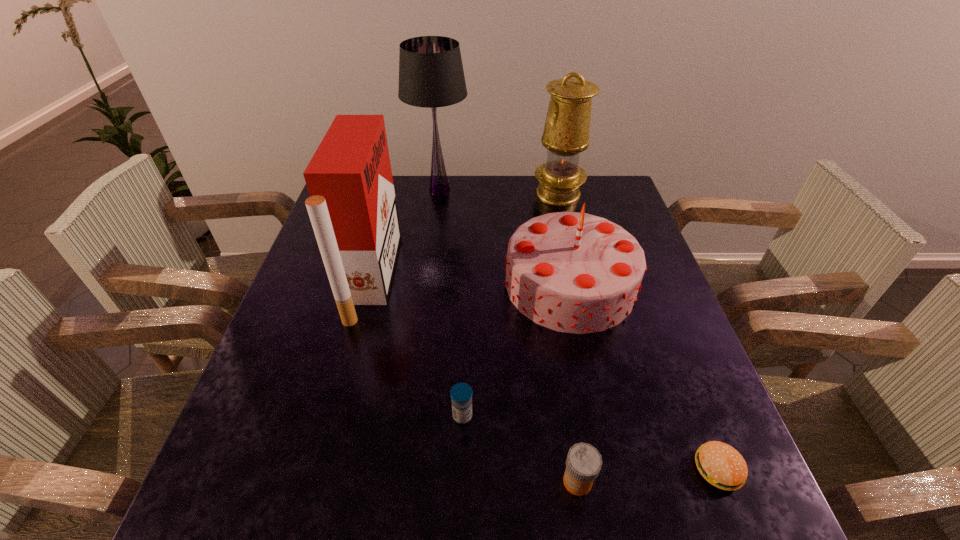
Where is `vacant space that satisfies the following two spatial constraints: 1. on the back side of the shortest object; 2. on the front-facing side of the cigarette case`? The image size is (960, 540). vacant space that satisfies the following two spatial constraints: 1. on the back side of the shortest object; 2. on the front-facing side of the cigarette case is located at coordinates (642, 276).

Image resolution: width=960 pixels, height=540 pixels. What are the coordinates of `free region that satisfies the following two spatial constraints: 1. on the front-facing side of the shortest object; 2. on the right side of the cigarette case` in the screenshot? It's located at (322, 470).

At what (x,y) coordinates should I click in order to perform the action: click on vacant area in the image that satisfies the following two spatial constraints: 1. on the front-facing side of the cigarette case; 2. on the back side of the left medicine. Please return your answer as a coordinate pair (x, y). This screenshot has width=960, height=540. Looking at the image, I should click on (335, 416).

Locate an element on the screen. This screenshot has width=960, height=540. free point that satisfies the following two spatial constraints: 1. on the back side of the farther medicine; 2. on the left side of the fourth tallest object is located at coordinates (467, 285).